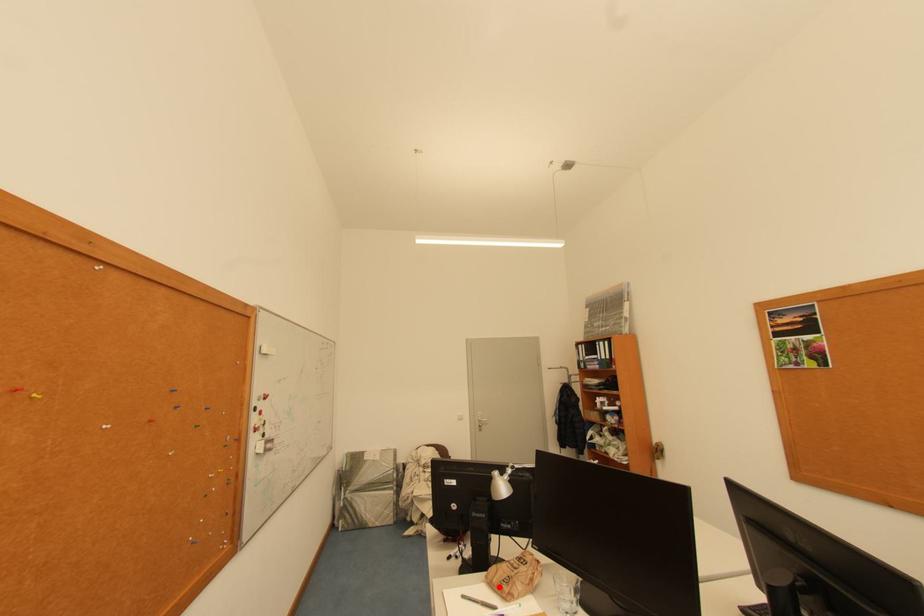
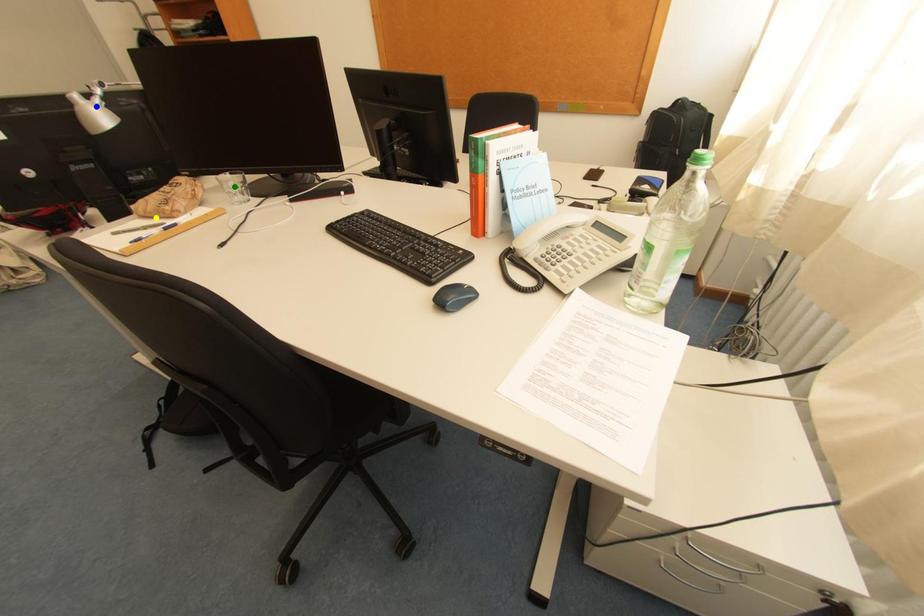
Question: I am providing you with two images of the same scene from different viewpoints. A red point is marked on the first image. You are given multiple points on the second image. Which spot in image 2 lines up with the point in image 1?

Choices:
 (A) green point
 (B) yellow point
 (C) blue point

Answer: (B)